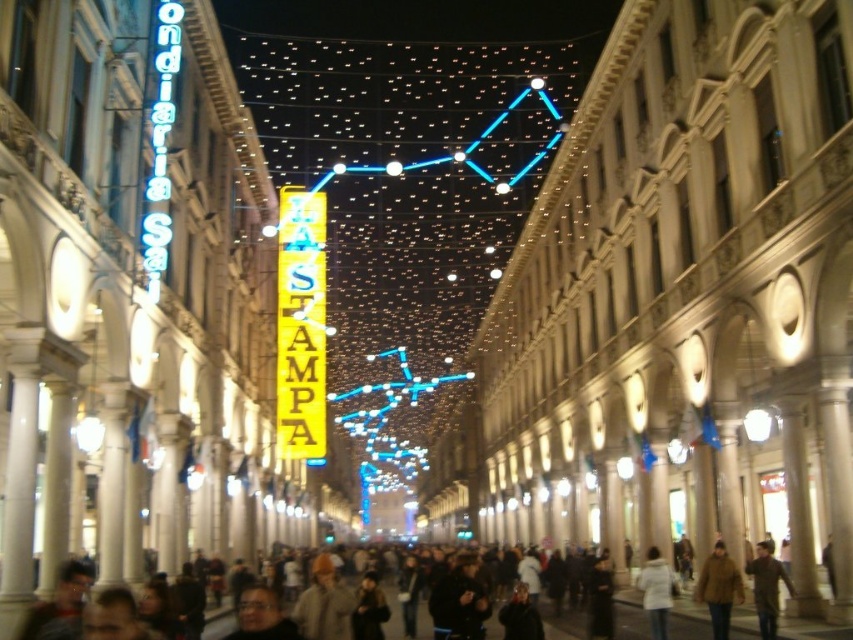
Question: Does dark brown clothing at lower center appear on the left side of white matte coat at center?

Choices:
 (A) no
 (B) yes

Answer: (B)

Question: Which is farther from the dark brown clothing at lower center?

Choices:
 (A) brown leather coat at center
 (B) brown wool coat at center

Answer: (A)

Question: Can you confirm if yellow neon sign at center is wider than white matte coat at center?

Choices:
 (A) no
 (B) yes

Answer: (B)

Question: Does yellow neon sign at center have a larger size compared to brown leather coat at center?

Choices:
 (A) no
 (B) yes

Answer: (B)

Question: Which point is farther to the camera?

Choices:
 (A) white matte coat at center
 (B) brown leather coat at center
 (C) illuminated string lights at center

Answer: (C)

Question: Which point appears farthest from the camera in this image?

Choices:
 (A) (715, 628)
 (B) (296, 208)
 (C) (764, 600)
 (D) (659, 573)

Answer: (B)